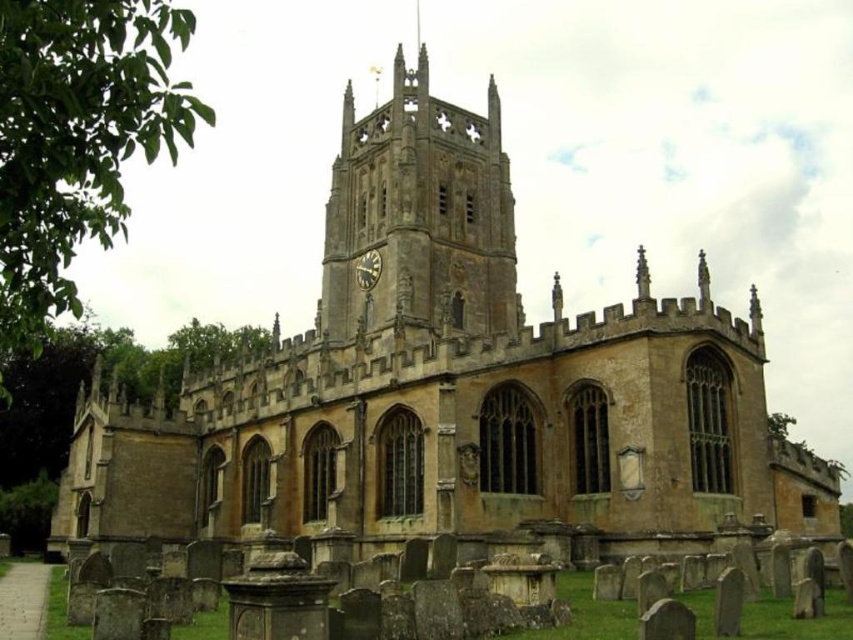
You are an architect designing a new church and want to ensure the golden stone tower at center and the matte gold clock at center are proportionally balanced. Based on the image, which object should you consider adjusting in width to achieve better balance?

The golden stone tower at center might be wider than the matte gold clock at center, so you should consider adjusting the width of the matte gold clock at center to match the tower for better balance.

You are standing in front of the historic church and want to take a photo of both the golden stone tower at center and the matte gold clock at center. However, you notice that one of them is partially blocking the other. Which object is blocking the other one?

The golden stone tower at center is in front of matte gold clock at center, so the tower is blocking the clock.